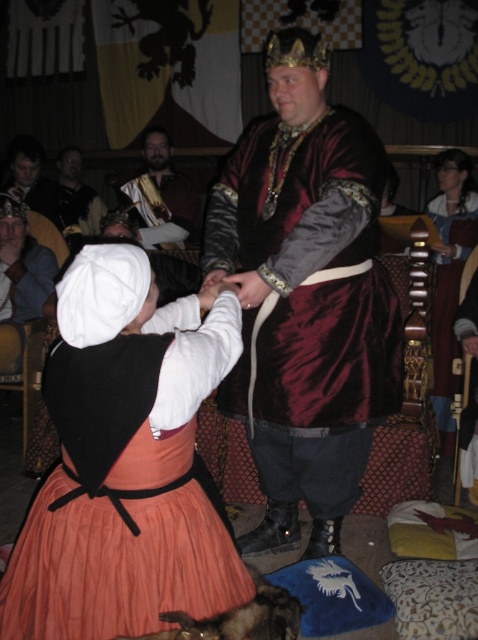
You are an archer aiming to hit a target located at point (76, 164). There is an obstacle at point (121, 540). Will your arrow pass in front of or behind the obstacle?

The obstacle at point (121, 540) is closer to the viewer than the target at point (76, 164). Therefore, your arrow will pass behind the obstacle at point (121, 540) before reaching the target.